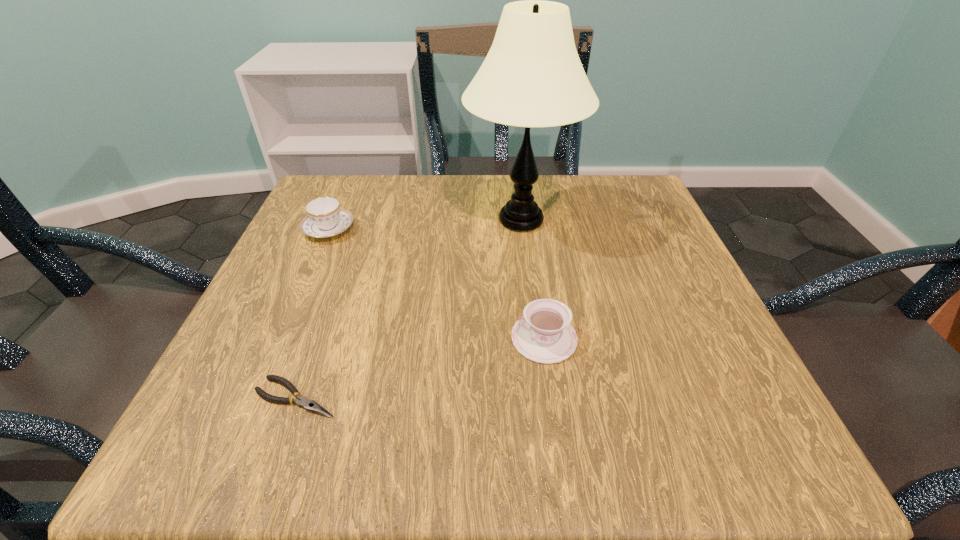
You are a GUI agent. You are given a task and a screenshot of the screen. Output one action in this format:
    pyautogui.click(x=<x>, y=<y>)
    Task: Click on the free space that satisfies the following two spatial constraints: 1. on the side with the handle of the lamp; 2. on the left side of the farther teacup
    The image size is (960, 540).
    Given the screenshot: What is the action you would take?
    coord(332,220)

Where is `vacant space that satisfies the following two spatial constraints: 1. on the back side of the lamp; 2. on the left side of the shortest object`? This screenshot has width=960, height=540. vacant space that satisfies the following two spatial constraints: 1. on the back side of the lamp; 2. on the left side of the shortest object is located at coordinates (359, 220).